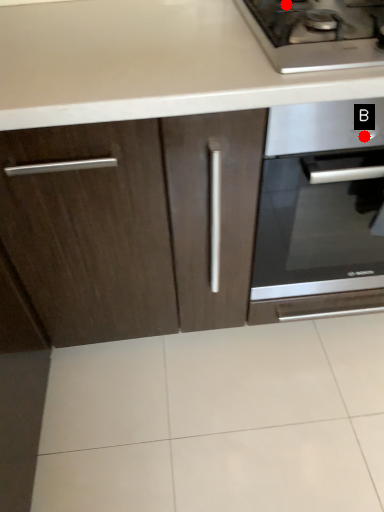
Question: Two points are circled on the image, labeled by A and B beside each circle. Which point is closer to the camera?

Choices:
 (A) A is closer
 (B) B is closer

Answer: (B)